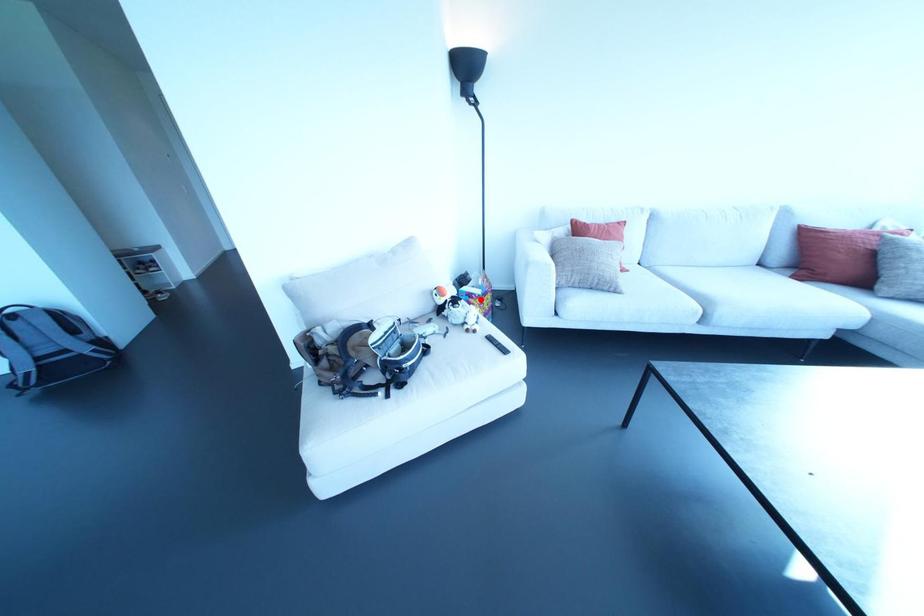
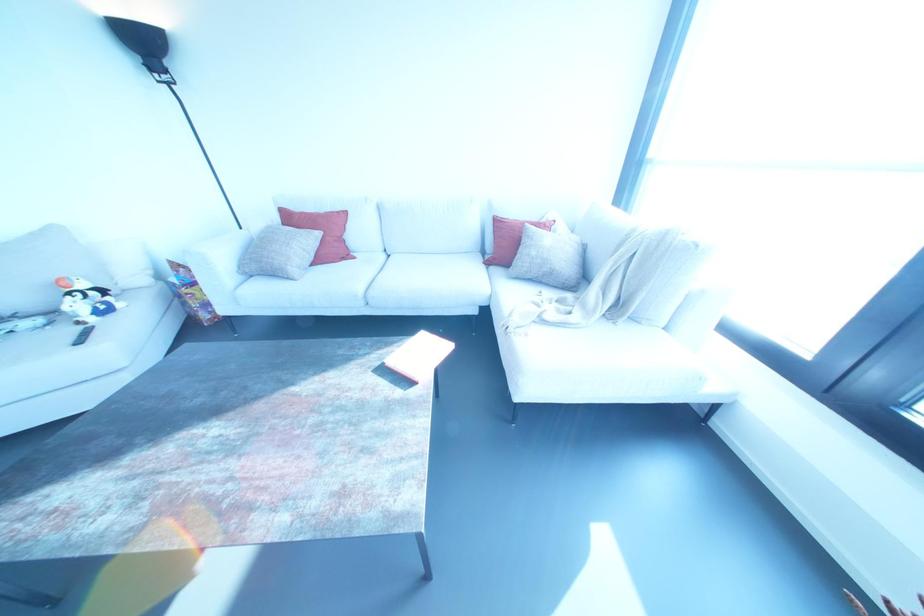
Question: I am providing you with two images of the same scene from different viewpoints. Given a red point in image1, look at the same physical point in image2. Is it:

Choices:
 (A) Closer to the viewpoint
 (B) Farther from the viewpoint

Answer: (A)